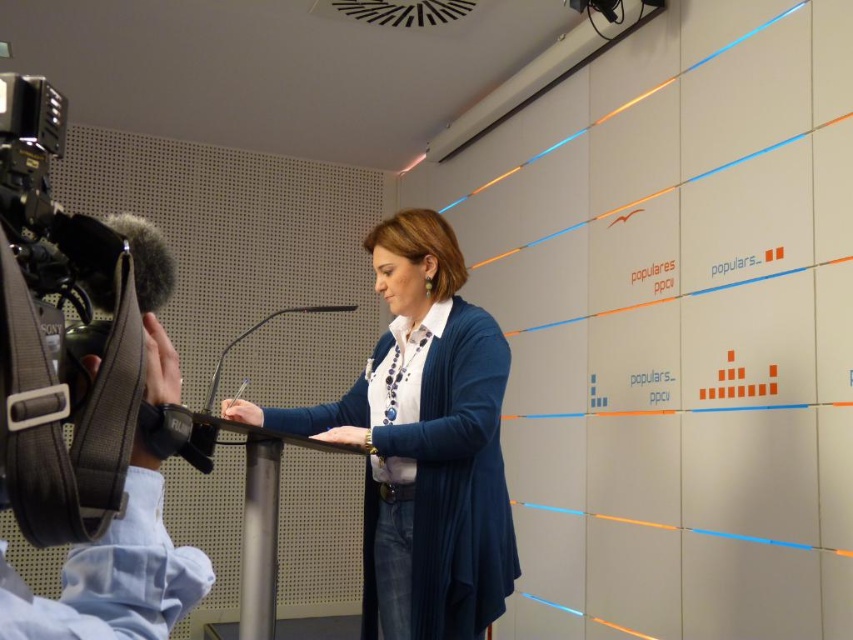
Describe the element at coordinates (114, 576) in the screenshot. I see `black fabric camera at left` at that location.

Which is above, black fabric camera at left or transparent plastic microphone at center?

Positioned higher is transparent plastic microphone at center.

Where is `black fabric camera at left`? The image size is (853, 640). black fabric camera at left is located at coordinates (114, 576).

Which of these two, blue fabric at center or black fabric camera at left, stands shorter?

With less height is black fabric camera at left.

Does blue fabric at center appear over black fabric camera at left?

No, blue fabric at center is not above black fabric camera at left.

Is point (459, 541) positioned after point (132, 243)?

Yes, it is behind point (132, 243).

This screenshot has width=853, height=640. Identify the location of blue fabric at center. (422, 444).

Between blue fabric at center and transparent plastic microphone at center, which one is positioned lower?

blue fabric at center is lower down.

Between point (453, 563) and point (328, 308), which one is positioned in front?

Positioned in front is point (453, 563).

Measure the distance between point (393, 282) and camera.

The distance of point (393, 282) from camera is 6.86 feet.

Where is `blue fabric at center`? This screenshot has width=853, height=640. blue fabric at center is located at coordinates (422, 444).